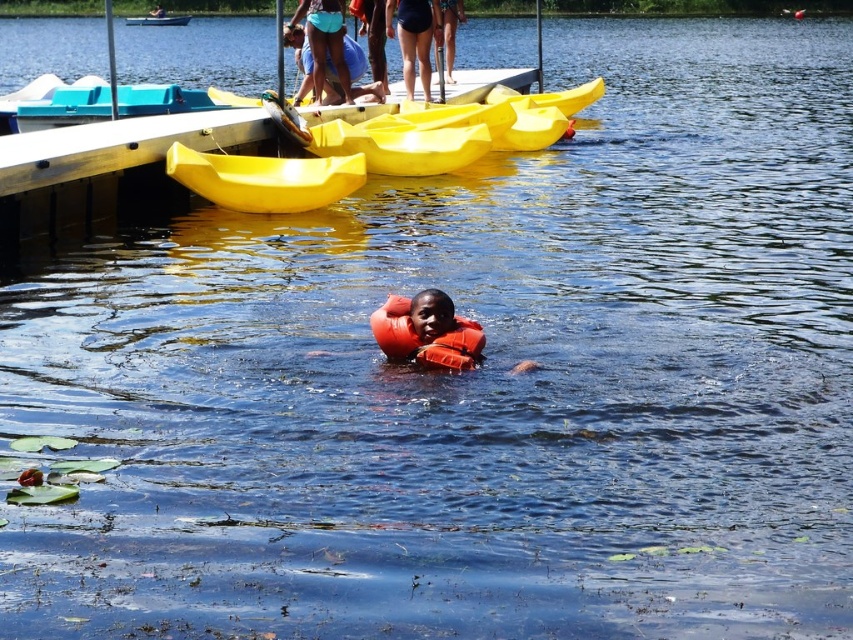
Does orange foam life jacket at center appear on the right side of black swimsuit at upper center?

Yes, orange foam life jacket at center is to the right of black swimsuit at upper center.

Does point (471, 360) come in front of point (409, 84)?

Yes, point (471, 360) is closer to viewer.

Does point (468, 326) lie behind point (402, 72)?

No, (468, 326) is closer to viewer.

Find the location of a particular element. This screenshot has height=640, width=853. orange foam life jacket at center is located at coordinates (425, 339).

Does teal fabric shorts at upper center have a greater width compared to black swimsuit at upper center?

Incorrect, teal fabric shorts at upper center's width does not surpass black swimsuit at upper center's.

Consider the image. Can you confirm if teal fabric shorts at upper center is positioned below black swimsuit at upper center?

Yes, teal fabric shorts at upper center is below black swimsuit at upper center.

Measure the distance between point [387,28] and camera.

Point [387,28] and camera are 26.54 meters apart from each other.

Where is `teal fabric shorts at upper center`? teal fabric shorts at upper center is located at coordinates (413, 35).

Is yellow matte kayak at upper center to the right of yellow plastic boat at upper center from the viewer's perspective?

Yes, yellow matte kayak at upper center is to the right of yellow plastic boat at upper center.

Can you confirm if yellow matte kayak at upper center is taller than yellow plastic boat at upper center?

Indeed, yellow matte kayak at upper center has a greater height compared to yellow plastic boat at upper center.

Between point (241, 205) and point (135, 24), which one is positioned behind?

The point (135, 24) is behind.

I want to click on yellow matte kayak at upper center, so click(265, 179).